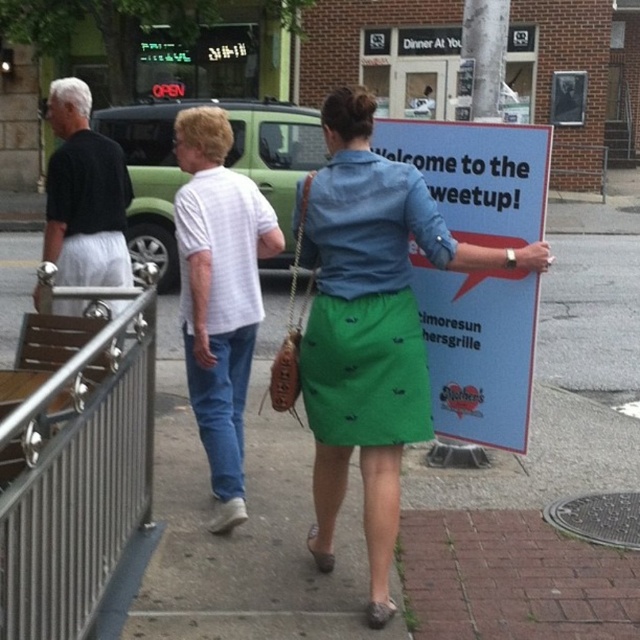
Between point (97, 410) and point (230, 212), which one is positioned in front?

Point (97, 410) is more forward.

Which is more to the right, satin silver railing at lower left or white woven shirt at center?

white woven shirt at center is more to the right.

I want to click on satin silver railing at lower left, so click(77, 474).

Where is `white woven shirt at center`? This screenshot has width=640, height=640. white woven shirt at center is located at coordinates (220, 294).

Between point (202, 141) and point (61, 88), which one is positioned in front?

Point (202, 141) is in front.

Where is `white woven shirt at center`? The height and width of the screenshot is (640, 640). white woven shirt at center is located at coordinates (220, 294).

Can you confirm if green fabric skirt at center is positioned above green printed skirt at center?

Yes, green fabric skirt at center is above green printed skirt at center.

Is green fabric skirt at center positioned at the back of green printed skirt at center?

Yes, green fabric skirt at center is further from the viewer.

Is point (196, 524) positioned after point (300, 355)?

Yes, point (196, 524) is farther from viewer.

Identify the location of green fabric skirt at center. (244, 524).